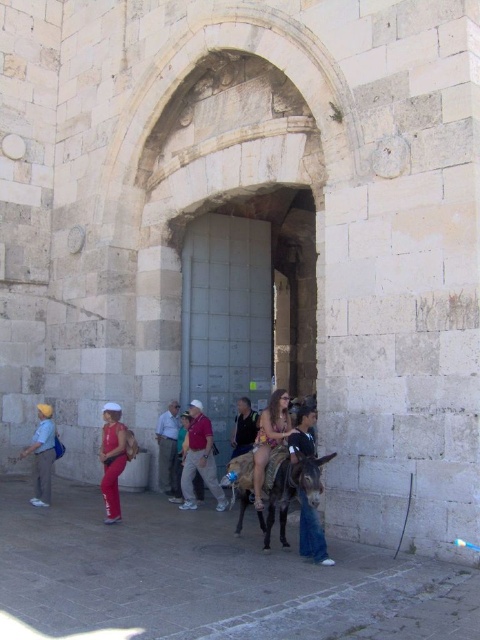
Is light brown leather pants at center further to the viewer compared to beige fabric bikini at center?

Yes, it is.

Is light brown leather pants at center to the right of beige fabric bikini at center from the viewer's perspective?

Incorrect, light brown leather pants at center is not on the right side of beige fabric bikini at center.

The width and height of the screenshot is (480, 640). Describe the element at coordinates (200, 460) in the screenshot. I see `light brown leather pants at center` at that location.

I want to click on light brown leather pants at center, so click(x=200, y=460).

Can you confirm if blue jeans at center is positioned below beige fabric bikini at center?

Indeed, blue jeans at center is positioned under beige fabric bikini at center.

The width and height of the screenshot is (480, 640). Identify the location of blue jeans at center. (312, 534).

Does point (324, 456) come farther from viewer compared to point (285, 390)?

That is False.

Does brown textured donkey at center appear over beige fabric bikini at center?

Actually, brown textured donkey at center is below beige fabric bikini at center.

Is point (300, 467) farther from camera compared to point (275, 396)?

No, (300, 467) is closer to viewer.

Where is `brown textured donkey at center`? This screenshot has width=480, height=640. brown textured donkey at center is located at coordinates (288, 488).